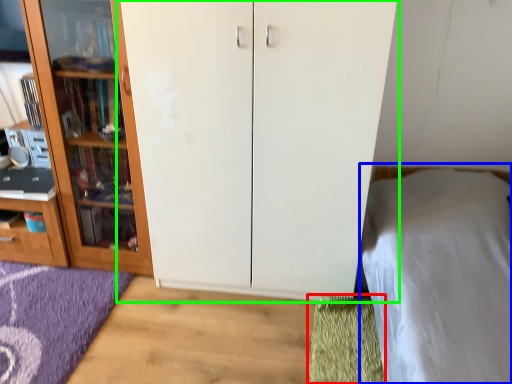
Question: Which object is the closest to the doormat (highlighted by a red box)? Choose among these: bed (highlighted by a blue box) or cupboard (highlighted by a green box).

Choices:
 (A) bed
 (B) cupboard

Answer: (A)